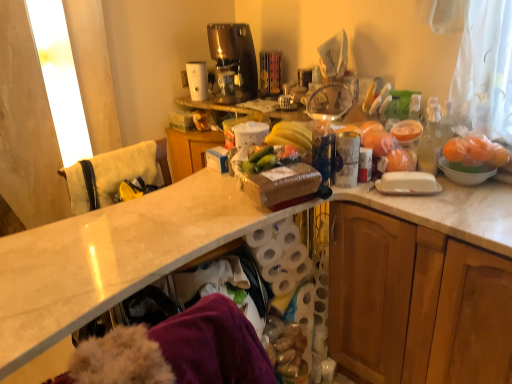
Question: Could green matte cucumber at center be considered to be inside white plastic coffee maker at upper center, which is counted as the second appliance, starting from the right?

Choices:
 (A) no
 (B) yes

Answer: (A)

Question: From the image's perspective, does white plastic coffee maker at upper center, placed as the second appliance when sorted from front to back, appear higher than green matte cucumber at center?

Choices:
 (A) no
 (B) yes

Answer: (B)

Question: Is white plastic coffee maker at upper center, which ranks as the first appliance in left-to-right order, bigger than green matte cucumber at center?

Choices:
 (A) no
 (B) yes

Answer: (B)

Question: Is white plastic coffee maker at upper center, placed as the second appliance when sorted from front to back, smaller than green matte cucumber at center?

Choices:
 (A) yes
 (B) no

Answer: (B)

Question: Does white plastic coffee maker at upper center, the second appliance when ordered from bottom to top, have a greater width compared to green matte cucumber at center?

Choices:
 (A) yes
 (B) no

Answer: (A)

Question: Is white plastic coffee maker at upper center, marked as the first appliance in a back-to-front arrangement, to the left of green matte cucumber at center from the viewer's perspective?

Choices:
 (A) no
 (B) yes

Answer: (B)

Question: Does white towel at left have a smaller size compared to transparent glass bowl at upper center, arranged as the 2th appliance when viewed from the top?

Choices:
 (A) no
 (B) yes

Answer: (A)

Question: Is white towel at left located outside transparent glass bowl at upper center, which appears as the second appliance when viewed from the left?

Choices:
 (A) no
 (B) yes

Answer: (B)

Question: Are white towel at left and transparent glass bowl at upper center, which ranks as the first appliance in right-to-left order, beside each other?

Choices:
 (A) no
 (B) yes

Answer: (A)

Question: From the image's perspective, is white towel at left located beneath transparent glass bowl at upper center, the 1th appliance positioned from the bottom?

Choices:
 (A) no
 (B) yes

Answer: (B)

Question: Can you confirm if white towel at left is positioned to the right of transparent glass bowl at upper center, the 1th appliance viewed from the front?

Choices:
 (A) no
 (B) yes

Answer: (A)

Question: Could you tell me if white towel at left is turned towards transparent glass bowl at upper center, the 1th appliance positioned from the bottom?

Choices:
 (A) yes
 (B) no

Answer: (B)

Question: Is green matte cucumber at center facing away from wooden cabinet at right?

Choices:
 (A) no
 (B) yes

Answer: (A)